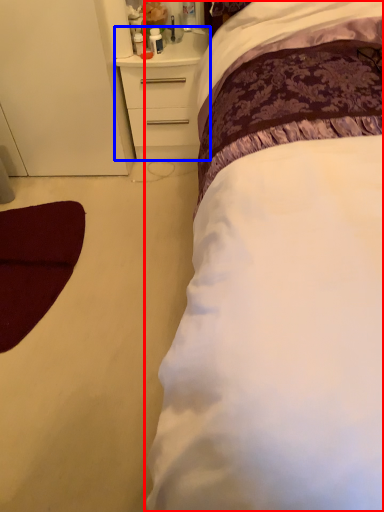
Question: Which point is closer to the camera, bed (highlighted by a red box) or chest of drawers (highlighted by a blue box)?

Choices:
 (A) bed
 (B) chest of drawers

Answer: (A)